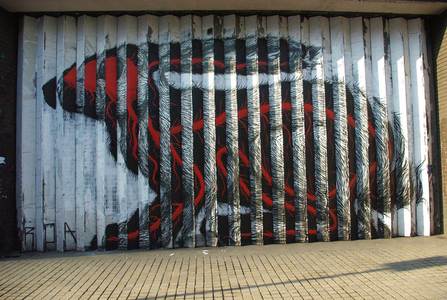
Find the location of a particular element. Image resolution: width=447 pixels, height=300 pixels. white wall is located at coordinates (59, 163).